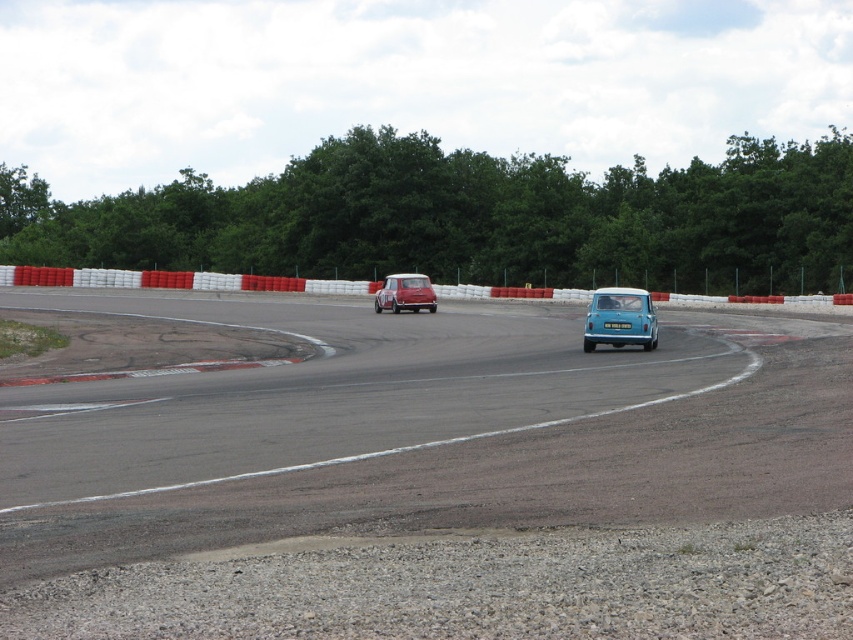
Question: Can you confirm if smooth asphalt race track at lower left is bigger than matte red car at center?

Choices:
 (A) no
 (B) yes

Answer: (B)

Question: Which object is farther from the camera taking this photo?

Choices:
 (A) red plastic barrier at center
 (B) matte red car at center

Answer: (A)

Question: Which object appears closest to the camera in this image?

Choices:
 (A) matte blue car at center
 (B) red plastic barrier at center
 (C) smooth asphalt race track at lower left
 (D) matte red car at center

Answer: (C)

Question: Among these points, which one is farthest from the camera?

Choices:
 (A) (618, 332)
 (B) (158, 272)

Answer: (B)

Question: Where is red plastic barrier at center located in relation to matte red car at center in the image?

Choices:
 (A) above
 (B) below

Answer: (B)

Question: In this image, where is smooth asphalt race track at lower left located relative to red plastic barrier at center?

Choices:
 (A) above
 (B) below

Answer: (B)